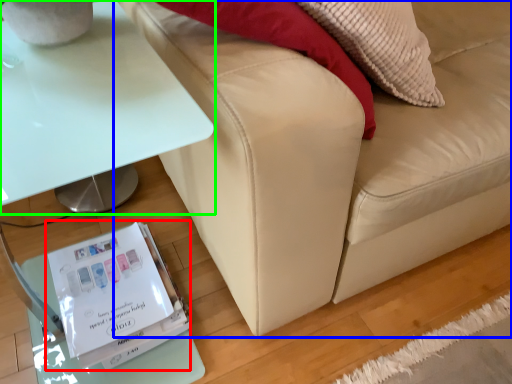
Question: Which object is the closest to the paperback book (highlighted by a red box)? Choose among these: studio couch (highlighted by a blue box) or table (highlighted by a green box).

Choices:
 (A) studio couch
 (B) table

Answer: (A)